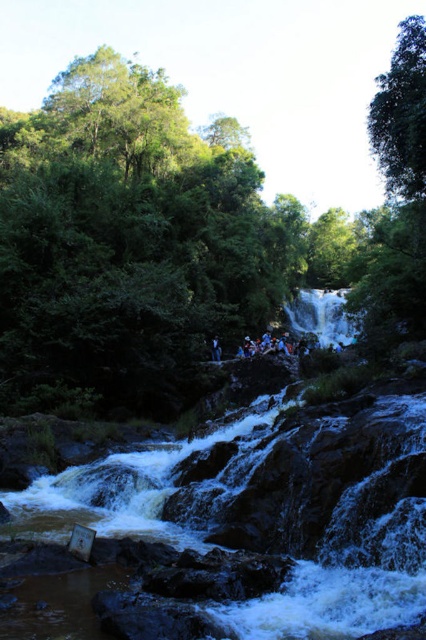
Is brown rocky creek at center taller than white smooth waterfall at center?

No, brown rocky creek at center is not taller than white smooth waterfall at center.

Does brown rocky creek at center appear under white smooth waterfall at center?

Yes.

Which is behind, point (423, 428) or point (322, 328)?

The point (322, 328) is behind.

Locate an element on the screen. brown rocky creek at center is located at coordinates (265, 516).

Who is shorter, brown rocky creek at center or dark blue fabric person at center?

dark blue fabric person at center is shorter.

Does brown rocky creek at center have a greater width compared to dark blue fabric person at center?

Yes, brown rocky creek at center is wider than dark blue fabric person at center.

The image size is (426, 640). What are the coordinates of `brown rocky creek at center` in the screenshot? It's located at (265, 516).

Which is behind, point (344, 342) or point (213, 348)?

The point (344, 342) is more distant.

Between point (316, 314) and point (213, 340), which one is positioned in front?

Point (213, 340) is in front.

This screenshot has height=640, width=426. Find the location of `white smooth waterfall at center`. white smooth waterfall at center is located at coordinates (322, 316).